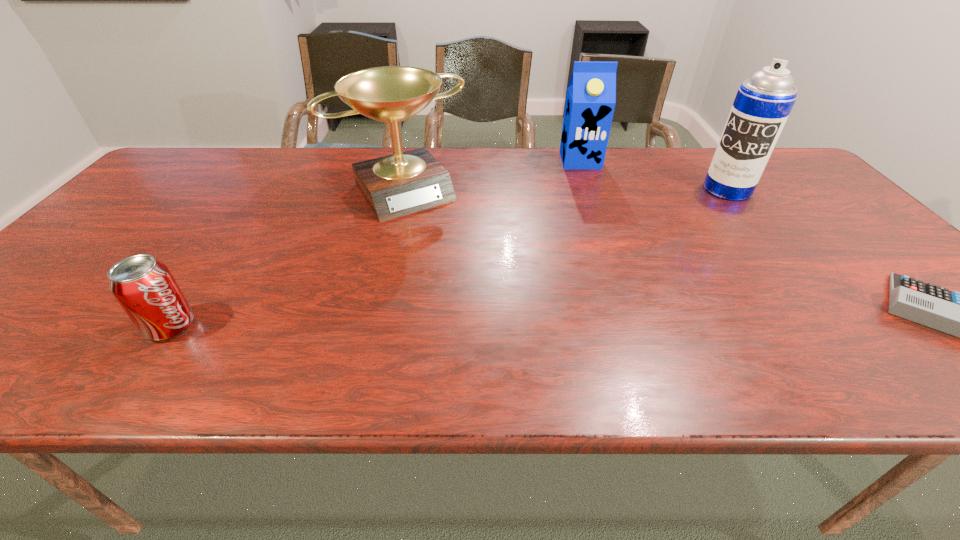
At what (x,y) coordinates should I click in order to perform the action: click on vacant space on the desktop that is between the leftmost object and the shortest object and is positioned on the label side of the second object from right to left. Please return your answer as a coordinate pair (x, y). The height and width of the screenshot is (540, 960). Looking at the image, I should click on (632, 315).

Locate an element on the screen. This screenshot has width=960, height=540. vacant spot on the desktop that is between the soda can and the shortest object and is positioned on the front-facing side of the fourth object from right to left is located at coordinates (498, 318).

You are a GUI agent. You are given a task and a screenshot of the screen. Output one action in this format:
    pyautogui.click(x=<x>, y=<y>)
    Task: Click on the vacant space on the desktop that is between the leftmost object and the rightmost object and is positioned with the cap open on the carton
    
    Given the screenshot: What is the action you would take?
    pyautogui.click(x=629, y=315)